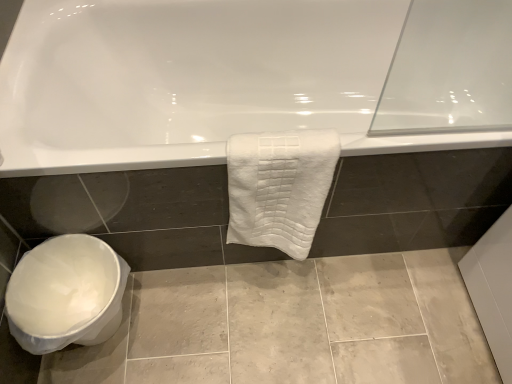
Locate an element on the screen. The height and width of the screenshot is (384, 512). vacant region above gray marble tile at lower left (from a real-world perspective) is located at coordinates (278, 323).